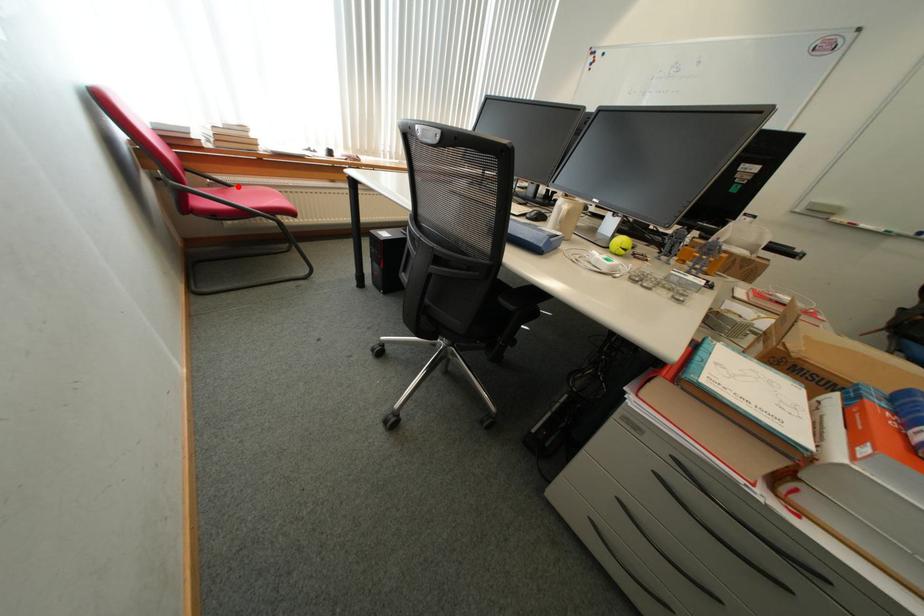
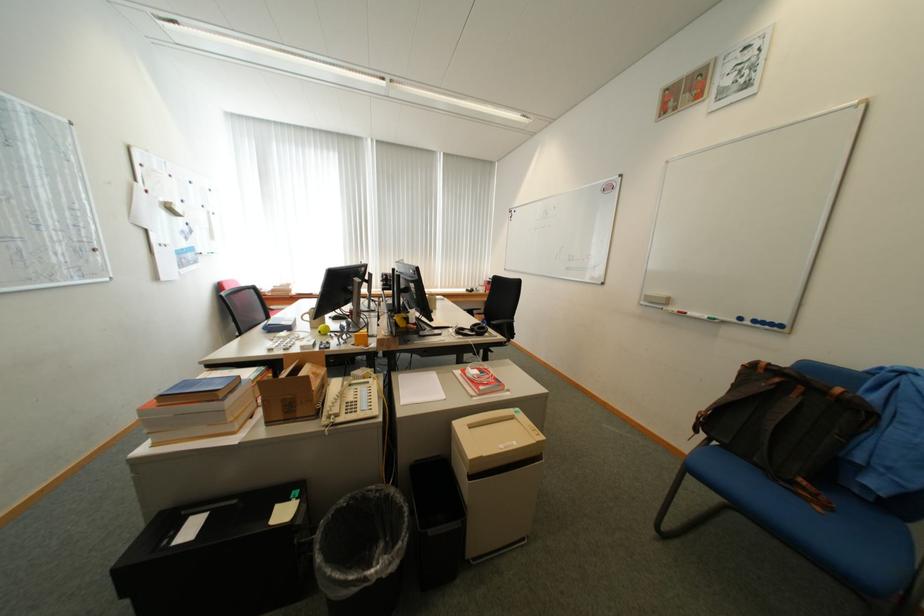
Question: I am providing you with two images of the same scene from different viewpoints. A red point is marked on the first image. Is the red point's position out of view in image 2?

Choices:
 (A) Yes
 (B) No

Answer: (A)